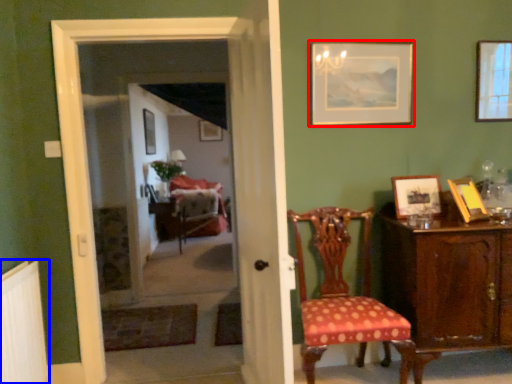
Question: Which point is further to the camera, picture frame (highlighted by a red box) or radiator (highlighted by a blue box)?

Choices:
 (A) picture frame
 (B) radiator

Answer: (A)